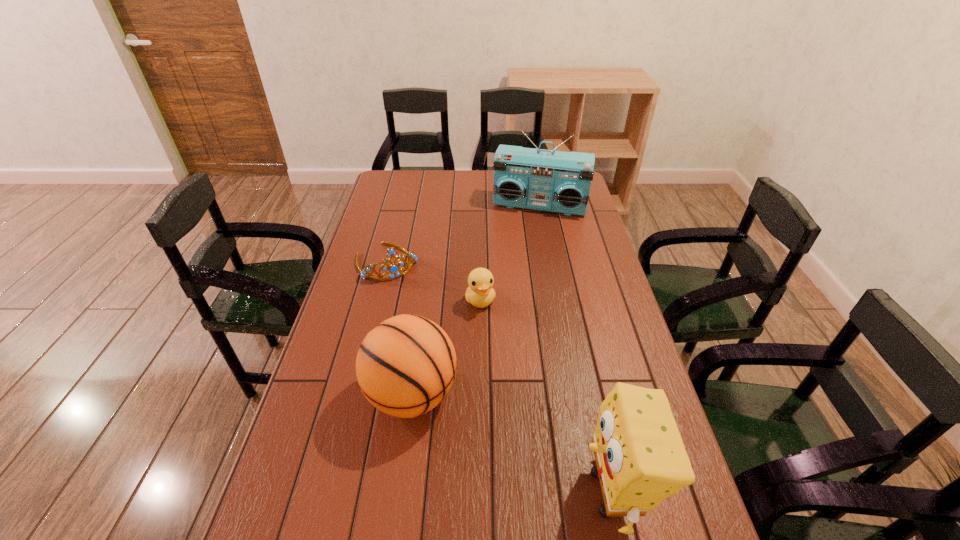
What are the coordinates of `free space at the far edge of the desktop` in the screenshot? It's located at (449, 173).

Where is `vacant space at the near edge of the desktop`? The width and height of the screenshot is (960, 540). vacant space at the near edge of the desktop is located at coordinates (482, 524).

This screenshot has height=540, width=960. Identify the location of free region at the left edge. 347,494.

Locate an element on the screen. The image size is (960, 540). vacant position at the right edge of the desktop is located at coordinates (620, 315).

Locate an element on the screen. Image resolution: width=960 pixels, height=540 pixels. free space between the second farthest object and the radio receiver is located at coordinates (464, 234).

Choose which object is the fourth nearest neighbor to the sponge. Please provide its 2D coordinates. Your answer should be formatted as a tuple, i.e. [(x, y)], where the tuple contains the x and y coordinates of a point satisfying the conditions above.

[(560, 182)]

Locate which object is the second closest to the radio receiver. Please provide its 2D coordinates. Your answer should be formatted as a tuple, i.e. [(x, y)], where the tuple contains the x and y coordinates of a point satisfying the conditions above.

[(480, 293)]